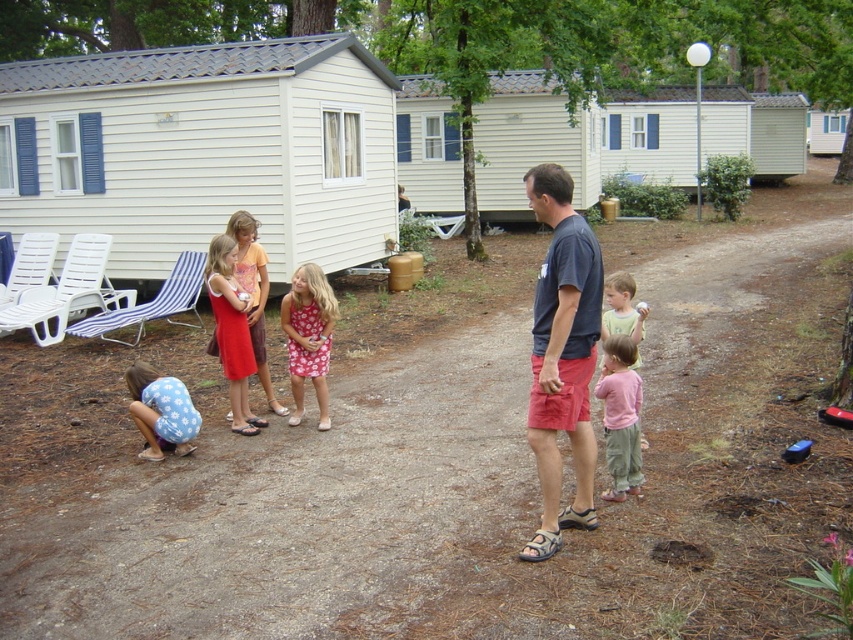
You are planning to sit between the matte red dress at center and the pink cotton shirt at right. Which side should you sit on to have enough space?

You should sit on the side of the matte red dress at center because it might be wider than the pink cotton shirt at right, providing more space.